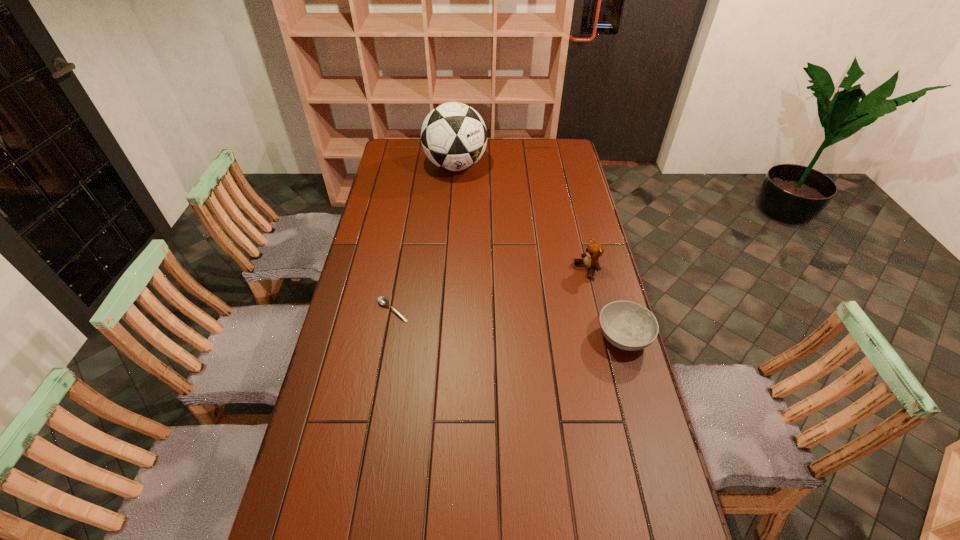
In order to click on free location located 0.140m on the surface of the tallest object where the brand logo is visible in this screenshot , I will do `click(464, 202)`.

Identify the location of vacant region located 0.390m on the front-facing side of the teddy bear. The width and height of the screenshot is (960, 540). (484, 316).

The height and width of the screenshot is (540, 960). In order to click on vacant area located on the front-facing side of the teddy bear in this screenshot , I will do `click(555, 285)`.

I want to click on vacant space located 0.060m on the front-facing side of the teddy bear, so click(564, 280).

Find the location of a particular element. The width and height of the screenshot is (960, 540). object that is at the far edge is located at coordinates (453, 135).

Locate an element on the screen. object that is positioned at the left edge is located at coordinates (383, 301).

Find the location of a particular element. The width and height of the screenshot is (960, 540). bowl present at the right edge is located at coordinates (627, 325).

At what (x,y) coordinates should I click in order to perform the action: click on teddy bear at the right edge. Please return your answer as a coordinate pair (x, y). This screenshot has height=540, width=960. Looking at the image, I should click on (594, 250).

In the image, there is a desktop. Where is `vacant space at the far edge`? vacant space at the far edge is located at coordinates (511, 151).

In the image, there is a desktop. Identify the location of vacant space at the left edge. The width and height of the screenshot is (960, 540). (326, 409).